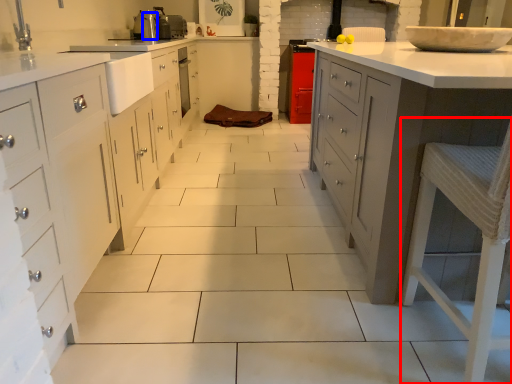
Question: Which object is further to the camera taking this photo, bar stool (highlighted by a red box) or appliance (highlighted by a blue box)?

Choices:
 (A) bar stool
 (B) appliance

Answer: (B)